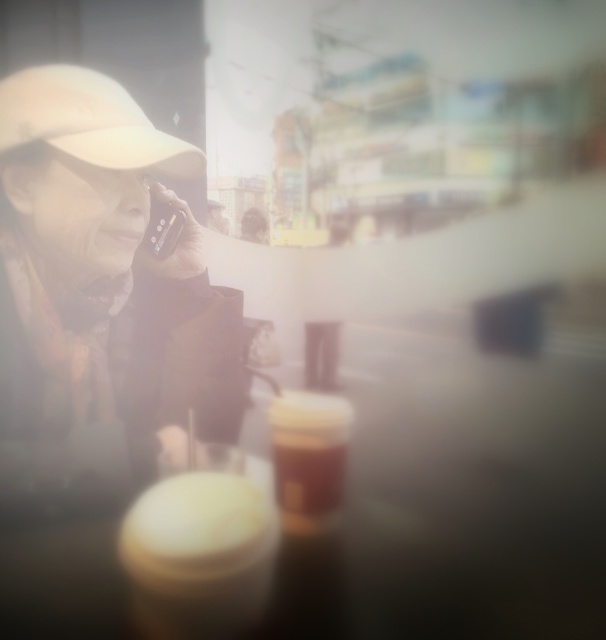
You are standing in a busy indoor location and see a point at coordinates [98,296]. What object is located at that point?

The point at coordinates [98,296] corresponds to the matte beige cap at left.